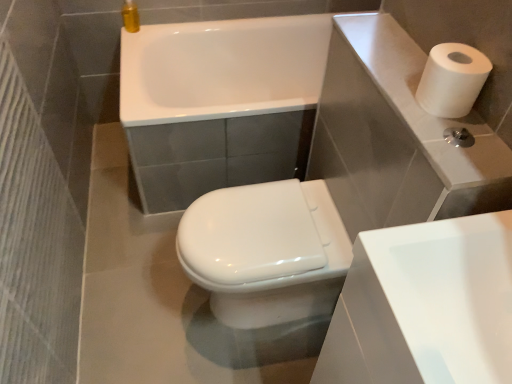
Question: Can you confirm if white glossy bathtub at upper center is wider than white matte paper towel at upper right?

Choices:
 (A) yes
 (B) no

Answer: (A)

Question: Is white glossy bathtub at upper center thinner than white matte paper towel at upper right?

Choices:
 (A) no
 (B) yes

Answer: (A)

Question: Can you confirm if white glossy bathtub at upper center is positioned to the left of white matte paper towel at upper right?

Choices:
 (A) no
 (B) yes

Answer: (B)

Question: Is white glossy bathtub at upper center positioned beyond the bounds of white matte paper towel at upper right?

Choices:
 (A) yes
 (B) no

Answer: (A)

Question: From the image's perspective, is white glossy bathtub at upper center located beneath white matte paper towel at upper right?

Choices:
 (A) no
 (B) yes

Answer: (A)

Question: Could you tell me if white glossy bathtub at upper center is facing white matte paper towel at upper right?

Choices:
 (A) yes
 (B) no

Answer: (B)

Question: Can you confirm if white matte paper towel at upper right is wider than white glossy sink at lower right?

Choices:
 (A) yes
 (B) no

Answer: (B)

Question: From a real-world perspective, is white matte paper towel at upper right positioned under white glossy sink at lower right based on gravity?

Choices:
 (A) yes
 (B) no

Answer: (B)

Question: Does white matte paper towel at upper right have a larger size compared to white glossy sink at lower right?

Choices:
 (A) yes
 (B) no

Answer: (B)

Question: Is white matte paper towel at upper right closer to the viewer compared to white glossy sink at lower right?

Choices:
 (A) no
 (B) yes

Answer: (A)

Question: From the image's perspective, would you say white matte paper towel at upper right is shown under white glossy sink at lower right?

Choices:
 (A) no
 (B) yes

Answer: (A)

Question: From a real-world perspective, is white matte paper towel at upper right over white glossy sink at lower right?

Choices:
 (A) yes
 (B) no

Answer: (A)

Question: Can you confirm if white glossy sink at lower right is thinner than white glossy bidet at center?

Choices:
 (A) yes
 (B) no

Answer: (A)